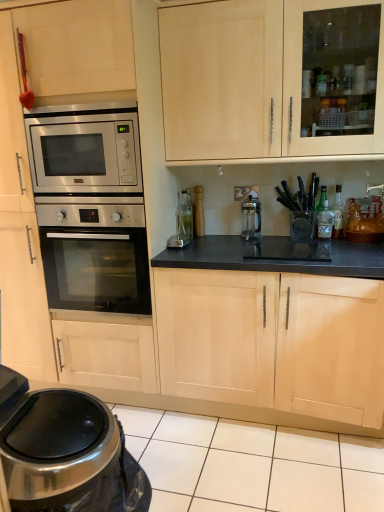
In order to click on free point in front of clear glass bottle at center right, the third bottle when ordered from left to right in this screenshot , I will do `click(347, 242)`.